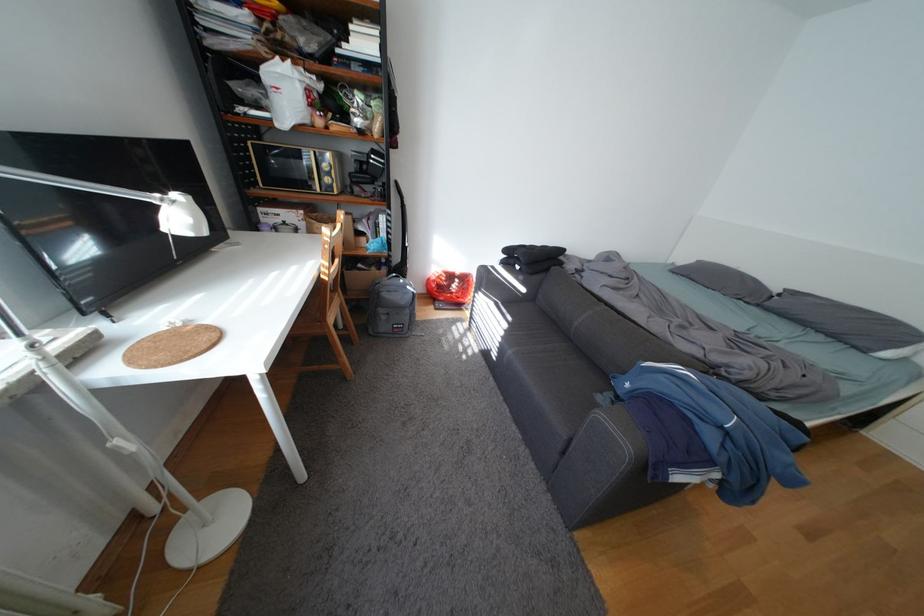
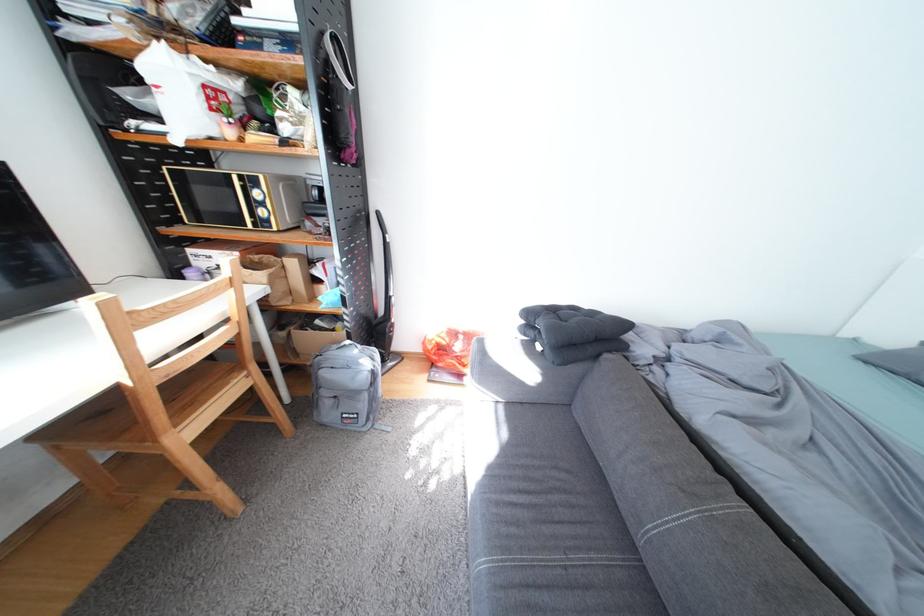
Find the pixel in the second image that matches point (420, 312) in the first image.

(378, 397)